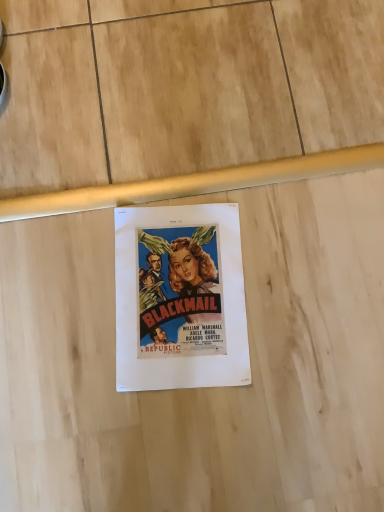
The width and height of the screenshot is (384, 512). Identify the location of free location above white paper poster at center (from a real-world perspective). (181, 292).